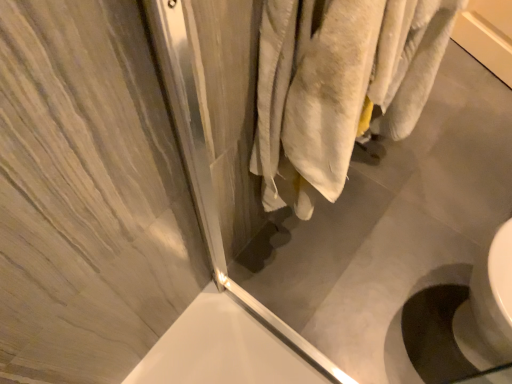
I want to click on free point behind translucent glass screen door at upper right, so click(309, 261).